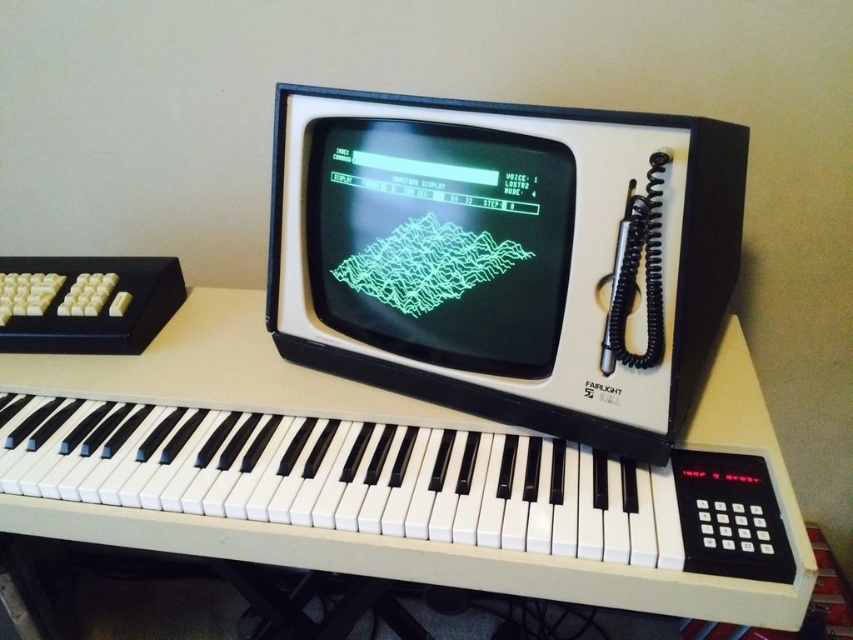
You are a music producer setting up your studio. You have a limited shelf space and need to arrange the white plastic piano at center and the matte black monitor at center. Which object should you place first to ensure they both fit vertically?

The white plastic piano at center has a lesser height compared to the matte black monitor at center, so you should place the taller matte black monitor at center first to ensure both fit vertically.

You are a musician trying to reach both the white plastic piano at center and the matte black monitor at center. Which one is closer to your hands when sitting at the synthesizer?

The white plastic piano at center is closer to your hands since it is positioned under the matte black monitor at center, placing it lower and more accessible.

In the scene shown: You are a musician trying to reach both the white plastic piano at center and the matte black monitor at center. Which one is located to the left?

The white plastic piano at center is positioned on the left side of the matte black monitor at center, so it is located to the left.